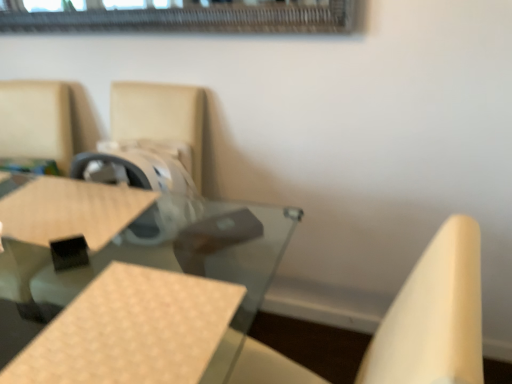
Question: From a real-world perspective, is beige woven plywood at center on top of clear glass table at center?

Choices:
 (A) no
 (B) yes

Answer: (B)

Question: From a real-world perspective, is beige woven plywood at center located beneath clear glass table at center?

Choices:
 (A) yes
 (B) no

Answer: (B)

Question: Is beige woven plywood at center to the right of clear glass table at center from the viewer's perspective?

Choices:
 (A) no
 (B) yes

Answer: (B)

Question: Considering the relative positions of beige woven plywood at center and clear glass table at center in the image provided, is beige woven plywood at center behind clear glass table at center?

Choices:
 (A) no
 (B) yes

Answer: (A)

Question: Is beige woven plywood at center wider than clear glass table at center?

Choices:
 (A) yes
 (B) no

Answer: (B)

Question: Is point click(23, 365) closer or farther from the camera than point click(200, 283)?

Choices:
 (A) closer
 (B) farther

Answer: (A)

Question: In terms of size, does clear glass table at center appear bigger or smaller than beige woven plywood at center?

Choices:
 (A) small
 (B) big

Answer: (B)

Question: Is clear glass table at center taller or shorter than beige woven plywood at center?

Choices:
 (A) tall
 (B) short

Answer: (A)

Question: Is clear glass table at center inside the boundaries of beige woven plywood at center, or outside?

Choices:
 (A) inside
 (B) outside

Answer: (B)

Question: In terms of size, does clear glass table at center appear bigger or smaller than matte brown chair at upper left?

Choices:
 (A) small
 (B) big

Answer: (B)

Question: In terms of height, does clear glass table at center look taller or shorter compared to matte brown chair at upper left?

Choices:
 (A) tall
 (B) short

Answer: (A)

Question: Is clear glass table at center in front of or behind matte brown chair at upper left in the image?

Choices:
 (A) behind
 (B) front

Answer: (B)

Question: Considering the positions of clear glass table at center and matte brown chair at upper left in the image, is clear glass table at center wider or thinner than matte brown chair at upper left?

Choices:
 (A) wide
 (B) thin

Answer: (A)

Question: In terms of width, does beige woven plywood at center look wider or thinner when compared to clear glass table at center?

Choices:
 (A) thin
 (B) wide

Answer: (A)

Question: Is beige woven plywood at center bigger or smaller than clear glass table at center?

Choices:
 (A) big
 (B) small

Answer: (B)